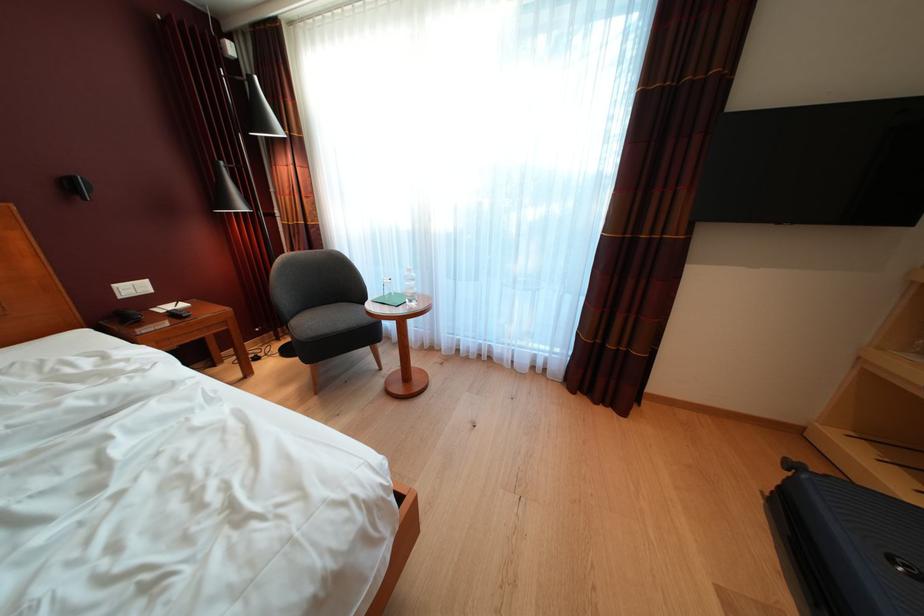
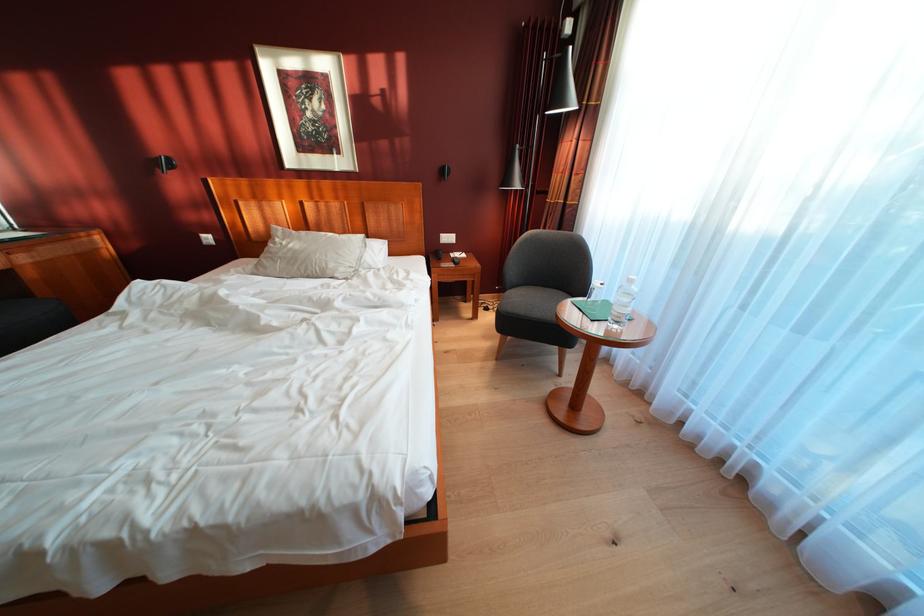
The point at (124, 292) is marked in the first image. Where is the corresponding point in the second image?

(450, 241)